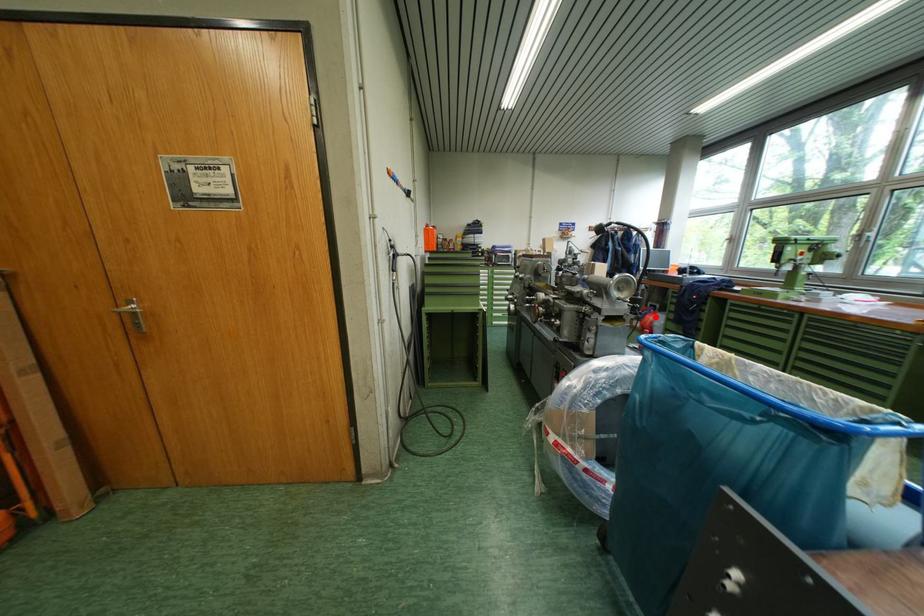
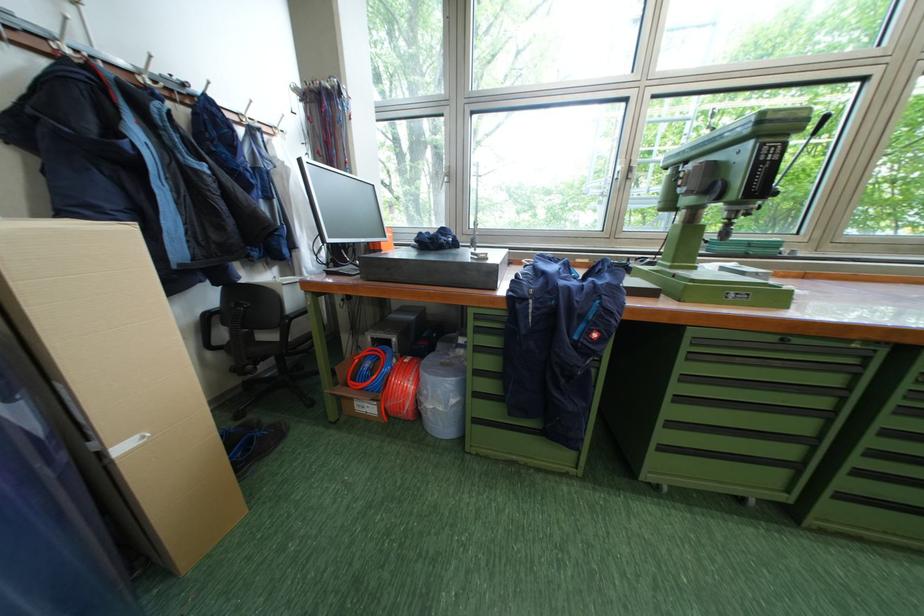
In the second image, find the point that corresponds to the highlighted location in the first image.

(396, 383)